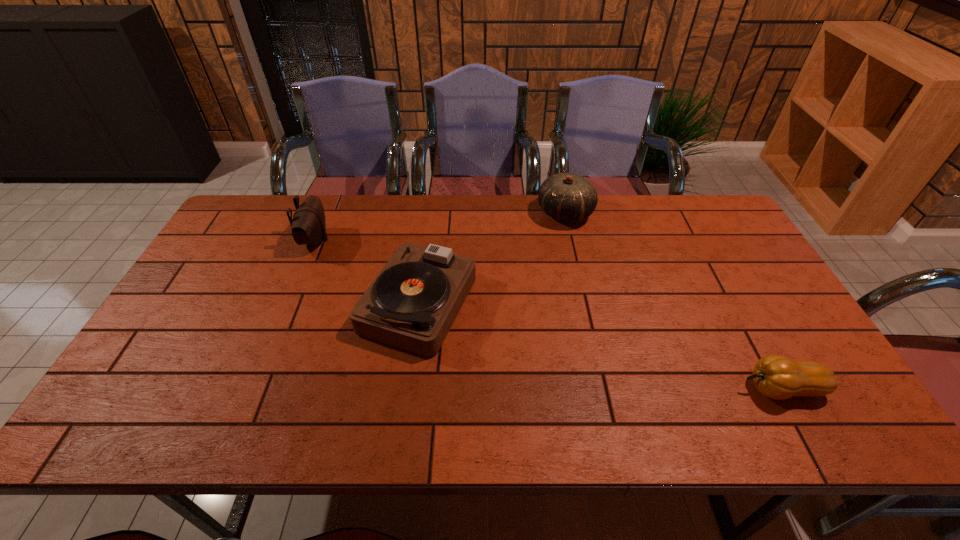
Image resolution: width=960 pixels, height=540 pixels. I want to click on free space located 0.170m on the stem side of the rightmost object, so click(666, 389).

Where is `free space located on the stem side of the rightmost object`? free space located on the stem side of the rightmost object is located at coordinates (614, 389).

The width and height of the screenshot is (960, 540). Find the location of `gourd that is at the far edge`. gourd that is at the far edge is located at coordinates (568, 197).

Where is `pouch that is at the far edge`? Image resolution: width=960 pixels, height=540 pixels. pouch that is at the far edge is located at coordinates (308, 226).

Where is `object located at the near edge`? The width and height of the screenshot is (960, 540). object located at the near edge is located at coordinates (775, 376).

The width and height of the screenshot is (960, 540). In order to click on object that is at the right edge in this screenshot , I will do `click(775, 376)`.

Where is `object that is at the near right corner`? The width and height of the screenshot is (960, 540). object that is at the near right corner is located at coordinates (775, 376).

Find the location of a particular element. blank space at the far edge of the desktop is located at coordinates (528, 206).

I want to click on free spot at the near edge of the desktop, so click(371, 410).

Find the location of `free space at the left edge`. free space at the left edge is located at coordinates (234, 240).